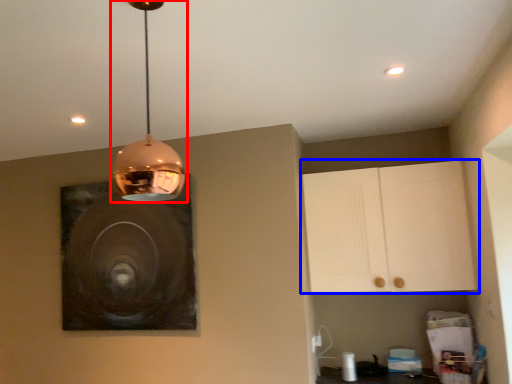
Question: Among these objects, which one is farthest to the camera, lamp (highlighted by a red box) or cabinetry (highlighted by a blue box)?

Choices:
 (A) lamp
 (B) cabinetry

Answer: (B)